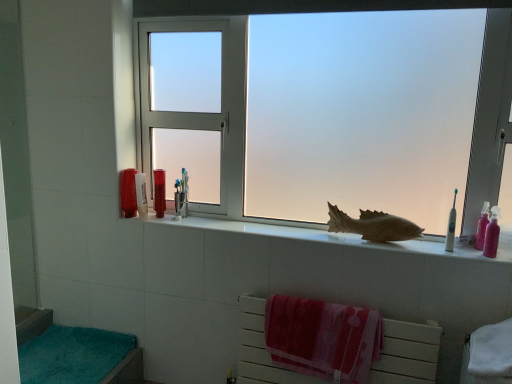
Locate an element on the screen. free space to the left of pink glossy toiletries at right, placed as the second toiletry when sorted from right to left is located at coordinates (457, 248).